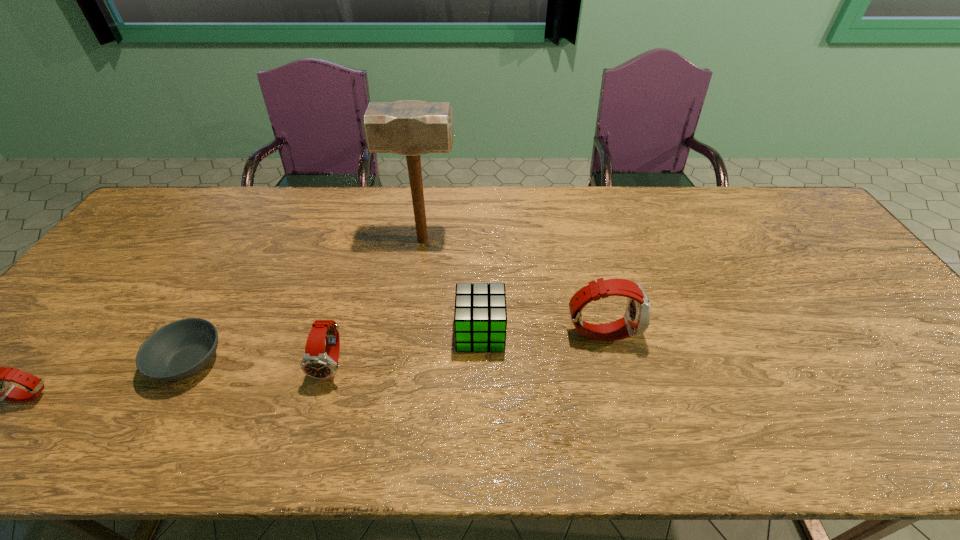
Where is `the second tallest watch`? The image size is (960, 540). the second tallest watch is located at coordinates (317, 363).

What are the coordinates of `the second watch from right to left` in the screenshot? It's located at (317, 363).

In order to click on the tallest watch in this screenshot , I will do `click(636, 320)`.

The height and width of the screenshot is (540, 960). What are the coordinates of `the fifth shortest object` in the screenshot? It's located at (636, 320).

Identify the location of the tallest object. This screenshot has height=540, width=960. (411, 128).

You are a GUI agent. You are given a task and a screenshot of the screen. Output one action in this format:
    pyautogui.click(x=<x>, y=<y>)
    Task: Click on the third object from right to left
    The width and height of the screenshot is (960, 540).
    Given the screenshot: What is the action you would take?
    pyautogui.click(x=411, y=128)

Find the location of a particular element. This screenshot has width=960, height=540. soup bowl is located at coordinates (181, 349).

Where is `the fifth object from right to left`? The height and width of the screenshot is (540, 960). the fifth object from right to left is located at coordinates (181, 349).

Where is `cube`? The image size is (960, 540). cube is located at coordinates (480, 316).

You are a GUI agent. You are given a task and a screenshot of the screen. Output one action in this format:
    pyautogui.click(x=<x>, y=<y>)
    Task: Click on the vacant region located 0.190m on the face of the tallest watch
    
    Given the screenshot: What is the action you would take?
    pyautogui.click(x=709, y=332)